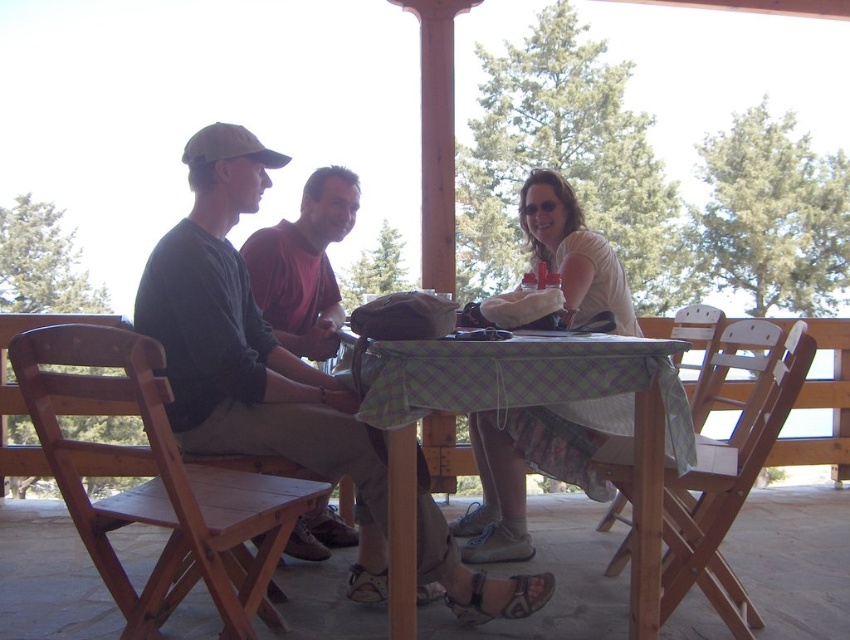
In the scene shown: You are standing at the point labeled as point (528, 468). What object is exactly at this point?

The point (528, 468) corresponds to the white cotton shirt at center.

You are standing at the center of the table. Which direction should you look to see the matte black shirt at left?

You should look to the left to see the matte black shirt at left since it is located at the left side of the scene.